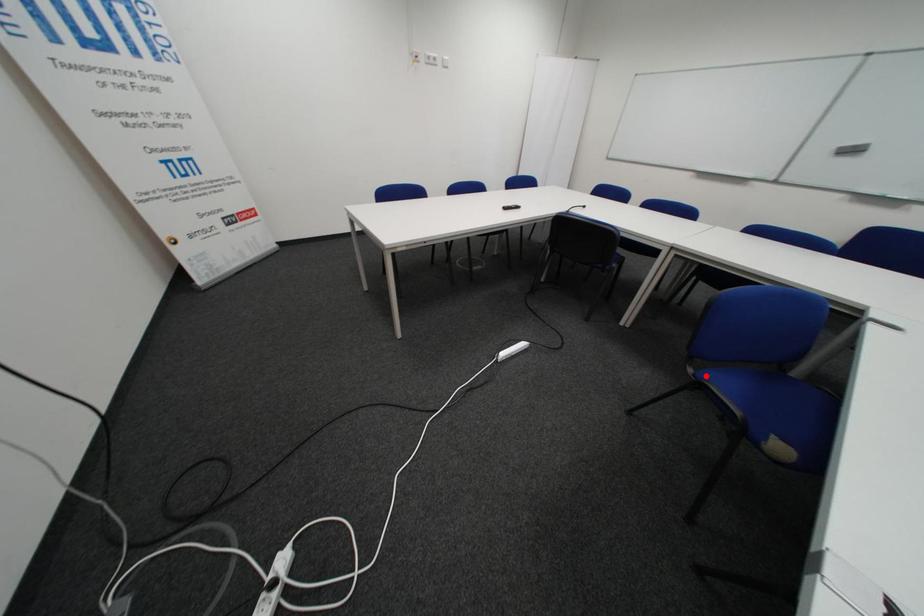
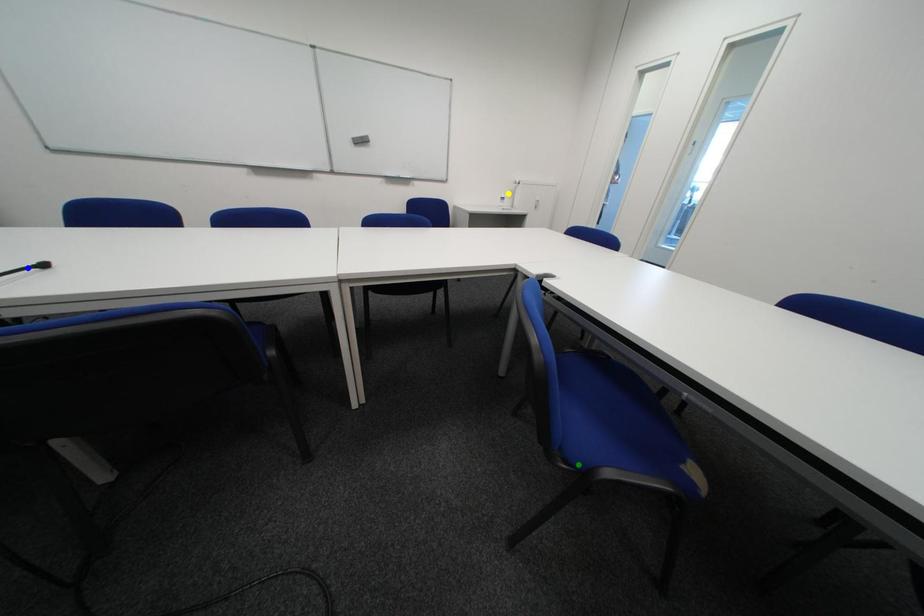
Question: I am providing you with two images of the same scene from different viewpoints. A red point is marked on the first image. You are given multiple points on the second image. In image 2, which mark is for the same physical point as the one in image 1?

Choices:
 (A) blue point
 (B) yellow point
 (C) green point

Answer: (C)